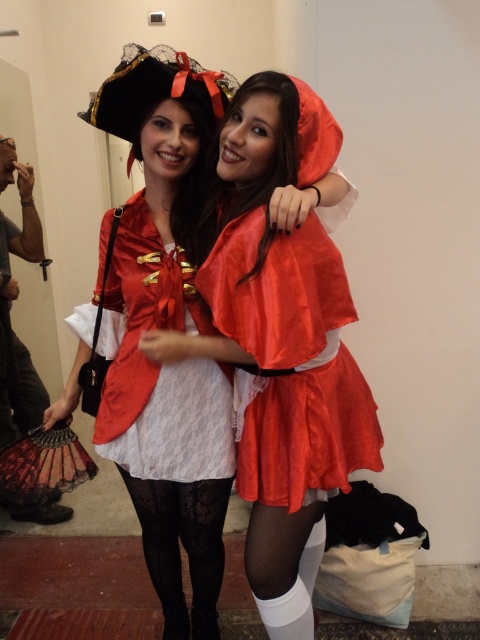
Question: Considering the relative positions of shiny satin cape at center and black lace tights at lower center in the image provided, where is shiny satin cape at center located with respect to black lace tights at lower center?

Choices:
 (A) below
 (B) above

Answer: (B)

Question: Can you confirm if satin red dress at center is thinner than matte lace fan at lower left?

Choices:
 (A) yes
 (B) no

Answer: (B)

Question: Does shiny satin cape at center come in front of satin red dress at center?

Choices:
 (A) no
 (B) yes

Answer: (B)

Question: Which object is farther from the camera taking this photo?

Choices:
 (A) matte lace fan at lower left
 (B) black lace tights at lower center
 (C) matte red dress at center
 (D) shiny satin cape at center

Answer: (A)

Question: Which point is farther to the camera?

Choices:
 (A) (0, 305)
 (B) (129, 440)
 (C) (181, 493)

Answer: (A)

Question: Which object is closer to the camera taking this photo?

Choices:
 (A) black lace tights at lower center
 (B) shiny satin cape at center
 (C) satin red dress at center

Answer: (B)